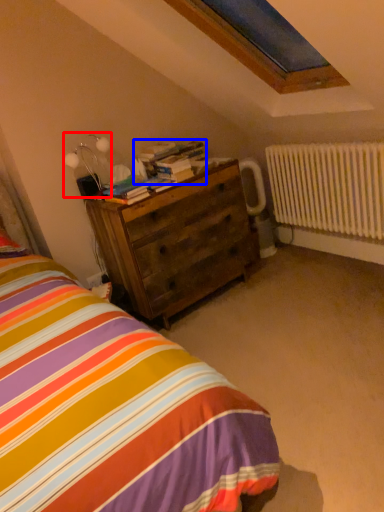
Question: Which object is closer to the camera taking this photo, table lamp (highlighted by a red box) or book (highlighted by a blue box)?

Choices:
 (A) table lamp
 (B) book

Answer: (A)